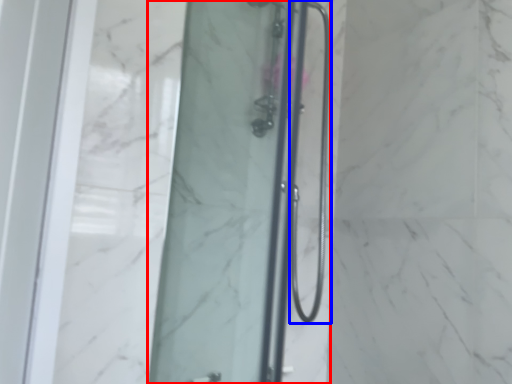
Question: Among these objects, which one is nearest to the camera, shower door (highlighted by a red box) or shower door (highlighted by a blue box)?

Choices:
 (A) shower door
 (B) shower door

Answer: (A)